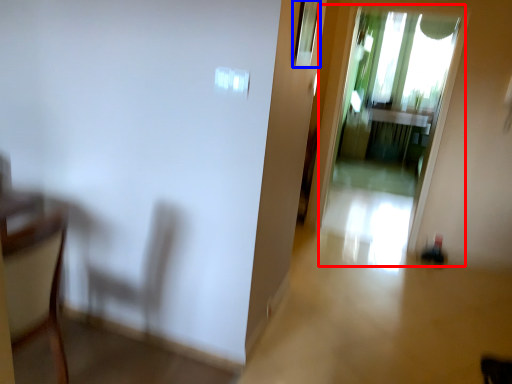
Question: Among these objects, which one is nearest to the camera, screen door (highlighted by a red box) or window (highlighted by a blue box)?

Choices:
 (A) screen door
 (B) window

Answer: (B)